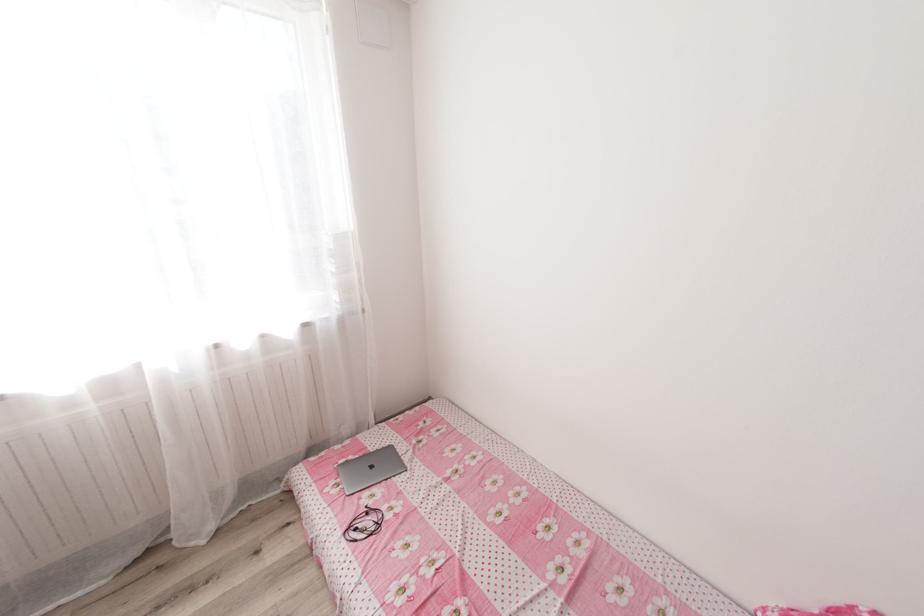
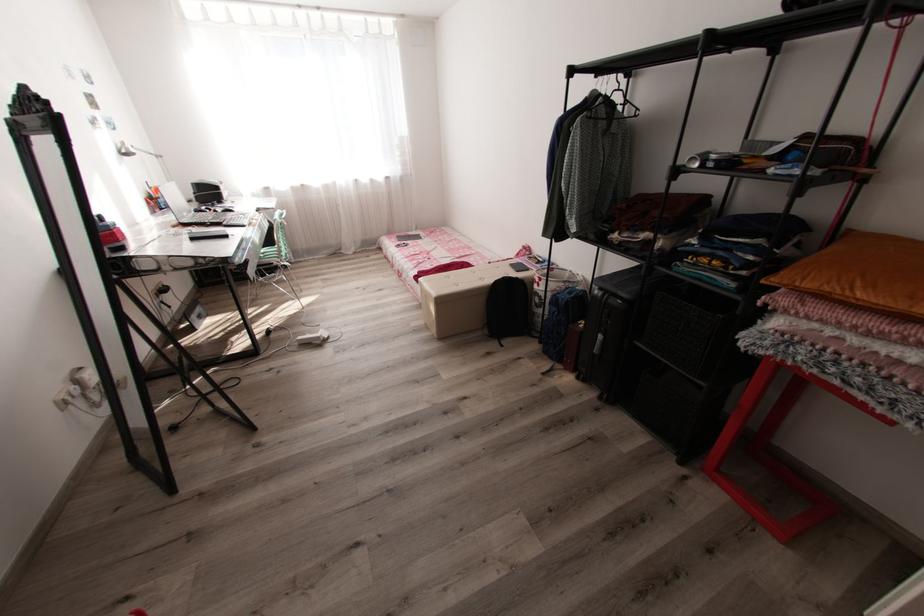
The images are taken continuously from a first-person perspective. In which direction are you moving?

The cameraman moved toward right, backward.